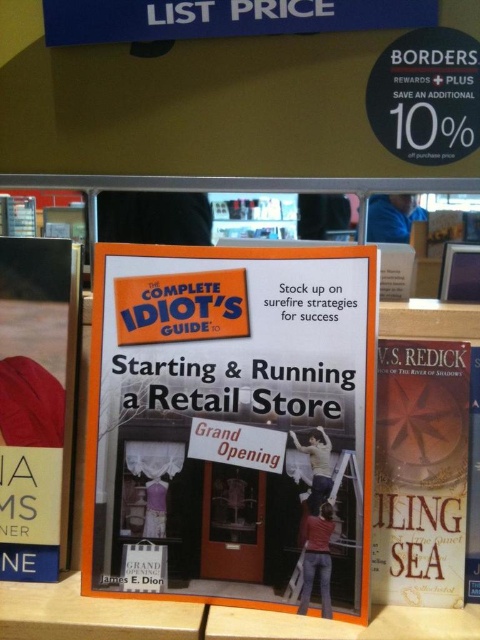
Can you confirm if orange matte book at center is smaller than hardcover book at left?

No, orange matte book at center is not smaller than hardcover book at left.

Who is more forward, [117,365] or [1,296]?

Point [117,365] is in front.

This screenshot has width=480, height=640. What are the coordinates of `orange matte book at center` in the screenshot? It's located at (228, 419).

Where is `orange matte book at center`? orange matte book at center is located at coordinates (228, 419).

Between point (330, 452) and point (474, 484), which one is positioned behind?

The point (330, 452) is more distant.

This screenshot has height=640, width=480. I want to click on orange matte book at center, so click(228, 419).

Can you confirm if orange matte book at center is positioned to the right of hardcover book at right?

Incorrect, orange matte book at center is not on the right side of hardcover book at right.

Locate an element on the screen. This screenshot has height=640, width=480. orange matte book at center is located at coordinates coord(228,419).

The height and width of the screenshot is (640, 480). What do you see at coordinates (228, 419) in the screenshot?
I see `orange matte book at center` at bounding box center [228, 419].

Where is `orange matte book at center`? orange matte book at center is located at coordinates (228, 419).